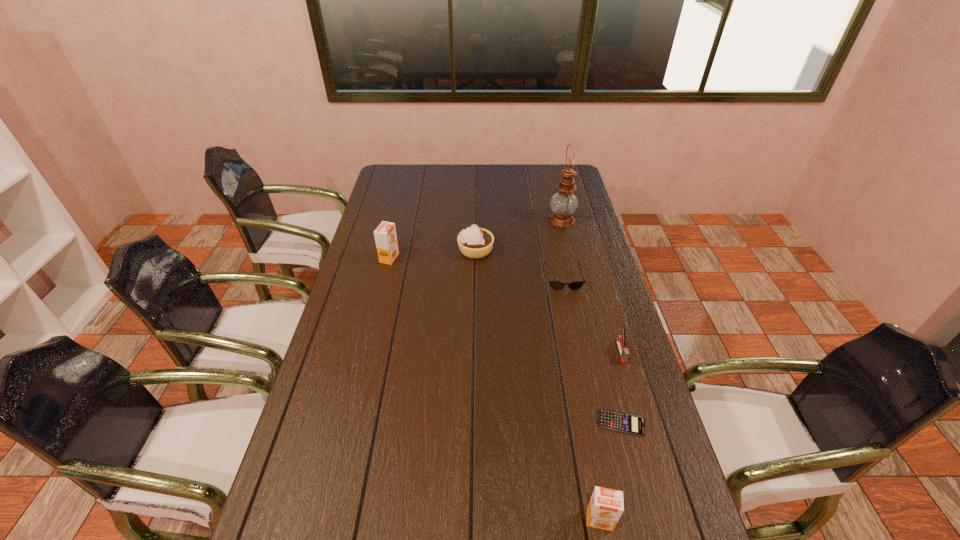
What are the coordinates of `vacant area between the calculator and the farthest object` in the screenshot? It's located at (591, 321).

Identify the location of free space between the leftmost object and the fifth farthest object. (505, 305).

You are a GUI agent. You are given a task and a screenshot of the screen. Output one action in this format:
    pyautogui.click(x=<x>, y=<y>)
    Task: Click on the third closest object to the leftmost object
    This screenshot has height=540, width=960.
    Given the screenshot: What is the action you would take?
    pyautogui.click(x=563, y=203)

Choose which object is the fourth nearest neighbor to the leftmost object. Please provide its 2D coordinates. Your answer should be formatted as a tuple, i.e. [(x, y)], where the tuple contains the x and y coordinates of a point satisfying the conditions above.

[(620, 340)]